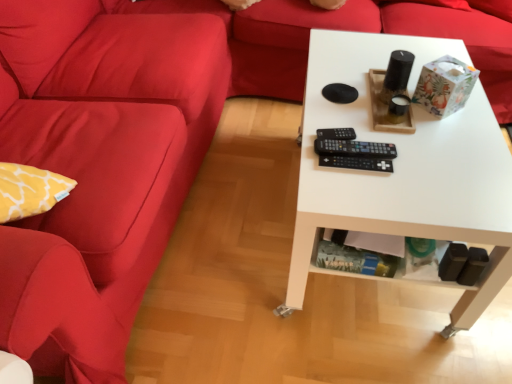
Where is `vacant location behind black plastic remote at center, arranged as the second control when viewed from the top`? The height and width of the screenshot is (384, 512). vacant location behind black plastic remote at center, arranged as the second control when viewed from the top is located at coordinates (350, 113).